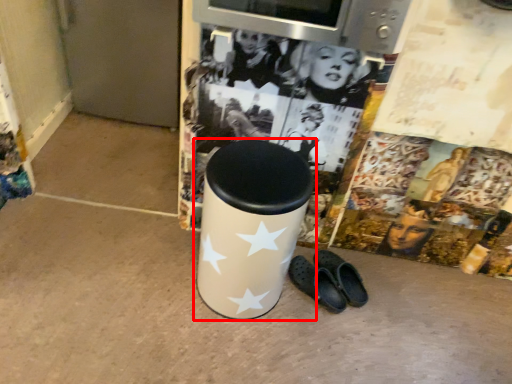
Question: From the image's perspective, where is waste container (annotated by the red box) located relative to footwear?

Choices:
 (A) below
 (B) above

Answer: (B)